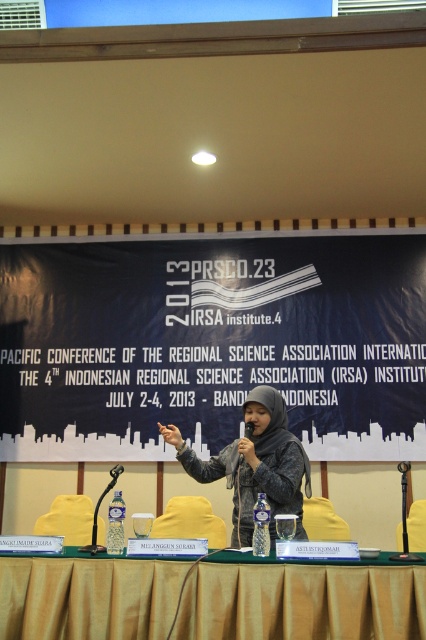
Question: Which object is closer to the camera taking this photo?

Choices:
 (A) black plastic microphone at center
 (B) matte gray hoodie at center
 (C) gold fabric table at center

Answer: (C)

Question: Which object is farther from the camera taking this photo?

Choices:
 (A) matte gray hoodie at center
 (B) black plastic microphone at center
 (C) gold fabric table at center

Answer: (B)

Question: Is the position of gold fabric table at center less distant than that of matte gray hoodie at center?

Choices:
 (A) yes
 (B) no

Answer: (A)

Question: From the image, what is the correct spatial relationship of gold fabric table at center in relation to matte gray hoodie at center?

Choices:
 (A) below
 (B) above

Answer: (A)

Question: Does gold fabric table at center have a larger size compared to matte gray hoodie at center?

Choices:
 (A) no
 (B) yes

Answer: (A)

Question: Which of the following is the closest to the observer?

Choices:
 (A) matte gray hoodie at center
 (B) gold fabric table at center
 (C) black plastic microphone at center

Answer: (B)